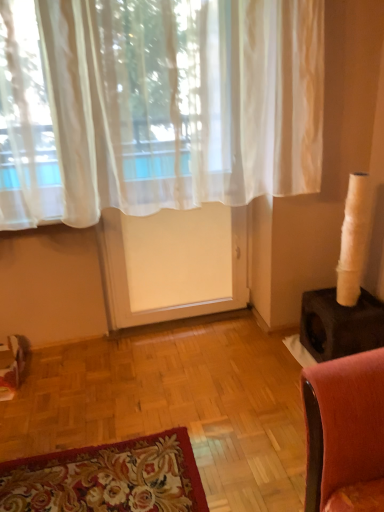
What is the approximate width of sheer white curtain at upper center?

7.72 inches.

The image size is (384, 512). What do you see at coordinates (156, 105) in the screenshot?
I see `sheer white curtain at upper center` at bounding box center [156, 105].

Image resolution: width=384 pixels, height=512 pixels. What are the coordinates of `sheer white curtain at upper center` in the screenshot? It's located at (156, 105).

Find the location of a particular element. white sheer screen door at center is located at coordinates (173, 263).

The height and width of the screenshot is (512, 384). What do you see at coordinates (173, 263) in the screenshot?
I see `white sheer screen door at center` at bounding box center [173, 263].

Measure the distance between point (111, 225) and camera.

The depth of point (111, 225) is 2.21 meters.

At what (x,y) coordinates should I click in order to perform the action: click on sheer white curtain at upper center. Please return your answer as a coordinate pair (x, y). This screenshot has height=512, width=384. Looking at the image, I should click on (156, 105).

Considering the relative positions of white sheer screen door at center and sheer white curtain at upper center in the image provided, is white sheer screen door at center to the left of sheer white curtain at upper center from the viewer's perspective?

Yes, white sheer screen door at center is to the left of sheer white curtain at upper center.

Who is more distant, white sheer screen door at center or sheer white curtain at upper center?

white sheer screen door at center is further away from the camera.

Is point (190, 267) more distant than point (311, 77)?

Yes, it is.

From the image's perspective, is white sheer screen door at center located above or below sheer white curtain at upper center?

Result: Clearly, from the image's perspective, white sheer screen door at center is below sheer white curtain at upper center.

From a real-world perspective, is white sheer screen door at center above or below sheer white curtain at upper center?

From a real-world perspective, white sheer screen door at center is physically below sheer white curtain at upper center.

Is white sheer screen door at center wider than sheer white curtain at upper center?

No, white sheer screen door at center is not wider than sheer white curtain at upper center.

Consider the image. Is white sheer screen door at center shorter than sheer white curtain at upper center?

No.

Considering the sizes of objects white sheer screen door at center and sheer white curtain at upper center in the image provided, who is bigger, white sheer screen door at center or sheer white curtain at upper center?

Bigger between the two is sheer white curtain at upper center.

Is white sheer screen door at center surrounding sheer white curtain at upper center?

Definitely not — sheer white curtain at upper center is not inside white sheer screen door at center.

Are white sheer screen door at center and sheer white curtain at upper center located far from each other?

white sheer screen door at center is near sheer white curtain at upper center, not far away.

Is white sheer screen door at center looking in the opposite direction of sheer white curtain at upper center?

Yes, white sheer screen door at center's orientation is away from sheer white curtain at upper center.

At what (x,y) coordinates should I click in order to perform the action: click on screen door that is behind the sheer white curtain at upper center. Please return your answer as a coordinate pair (x, y). This screenshot has height=512, width=384. Looking at the image, I should click on (173, 263).

Can you confirm if sheer white curtain at upper center is positioned to the left of white sheer screen door at center?

In fact, sheer white curtain at upper center is to the right of white sheer screen door at center.

Relative to white sheer screen door at center, is sheer white curtain at upper center in front or behind?

Visually, sheer white curtain at upper center is located in front of white sheer screen door at center.

Between point (56, 52) and point (131, 242), which one is positioned in front?

The point (56, 52) is closer.

From the image's perspective, is sheer white curtain at upper center over white sheer screen door at center?

Yes, from the image's perspective, sheer white curtain at upper center is above white sheer screen door at center.

From a real-world perspective, who is located higher, sheer white curtain at upper center or white sheer screen door at center?

In real-world perspective, sheer white curtain at upper center is above.

Based on the photo, considering the sizes of sheer white curtain at upper center and white sheer screen door at center in the image, is sheer white curtain at upper center wider or thinner than white sheer screen door at center?

Considering their sizes, sheer white curtain at upper center looks broader than white sheer screen door at center.

Considering the relative sizes of sheer white curtain at upper center and white sheer screen door at center in the image provided, is sheer white curtain at upper center taller than white sheer screen door at center?

In fact, sheer white curtain at upper center may be shorter than white sheer screen door at center.

Does sheer white curtain at upper center have a smaller size compared to white sheer screen door at center?

Incorrect, sheer white curtain at upper center is not smaller in size than white sheer screen door at center.

Is sheer white curtain at upper center inside the boundaries of white sheer screen door at center, or outside?

The correct answer is: outside.

Is there a large distance between sheer white curtain at upper center and white sheer screen door at center?

Actually, sheer white curtain at upper center and white sheer screen door at center are a little close together.

Is sheer white curtain at upper center oriented towards white sheer screen door at center?

No, sheer white curtain at upper center is not aimed at white sheer screen door at center.

How many degrees apart are the facing directions of sheer white curtain at upper center and white sheer screen door at center?

There is a 0.00617-degree angle between the facing directions of sheer white curtain at upper center and white sheer screen door at center.

In order to click on screen door located below the sheer white curtain at upper center (from the image's perspective) in this screenshot , I will do `click(173, 263)`.

Find the location of a particular element. This screenshot has height=512, width=384. screen door below the sheer white curtain at upper center (from the image's perspective) is located at coordinates (173, 263).

Where is `screen door that is behind the sheer white curtain at upper center`? screen door that is behind the sheer white curtain at upper center is located at coordinates (173, 263).